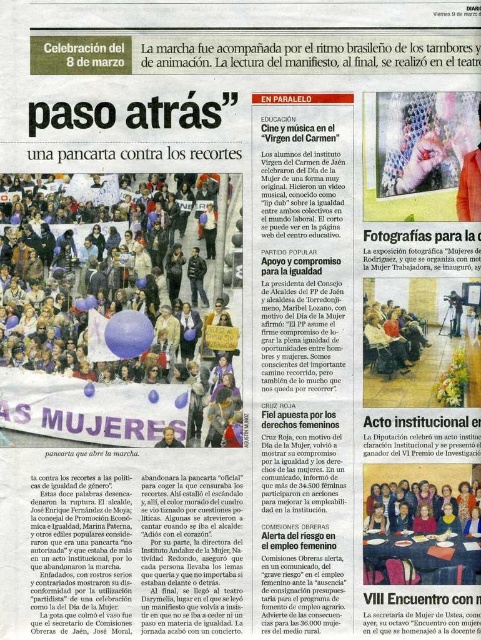
Is matte black dress at center positioned before matte black camera at center?

Yes, matte black dress at center is in front of matte black camera at center.

Looking at this image, between matte black dress at center and matte black camera at center, which one is positioned higher?

matte black camera at center

Is point (430, 531) farther from camera compared to point (453, 321)?

Yes, point (430, 531) is behind point (453, 321).

At what (x,y) coordinates should I click in order to perform the action: click on matte black dress at center. Please return your answer as a coordinate pair (x, y). Looking at the image, I should click on (416, 506).

Which is more to the left, matte brown wooden chair at center or textured fabric scarf at upper center?

From the viewer's perspective, matte brown wooden chair at center appears more on the left side.

In order to click on matte brown wooden chair at center in this screenshot , I will do `click(391, 339)`.

Image resolution: width=481 pixels, height=640 pixels. I want to click on matte brown wooden chair at center, so click(x=391, y=339).

Is white paper banner at center smaller than textured fabric scarf at upper center?

→ Incorrect, white paper banner at center is not smaller in size than textured fabric scarf at upper center.

Can you confirm if white paper banner at center is positioned to the right of textured fabric scarf at upper center?

In fact, white paper banner at center is to the left of textured fabric scarf at upper center.

This screenshot has width=481, height=640. Describe the element at coordinates (102, 332) in the screenshot. I see `white paper banner at center` at that location.

Locate an element on the screen. white paper banner at center is located at coordinates (102, 332).